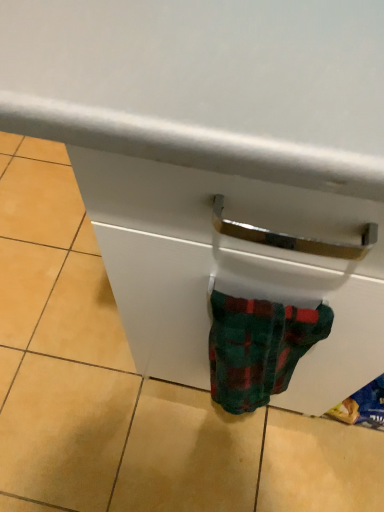
Question: From a real-world perspective, is white glossy drawer at center located higher than fluffy plaid sock at lower right?

Choices:
 (A) no
 (B) yes

Answer: (A)

Question: Is white glossy drawer at center facing towards fluffy plaid sock at lower right?

Choices:
 (A) yes
 (B) no

Answer: (B)

Question: Considering the relative sizes of white glossy drawer at center and fluffy plaid sock at lower right in the image provided, is white glossy drawer at center bigger than fluffy plaid sock at lower right?

Choices:
 (A) no
 (B) yes

Answer: (B)

Question: Does white glossy drawer at center have a greater height compared to fluffy plaid sock at lower right?

Choices:
 (A) yes
 (B) no

Answer: (B)

Question: From the image's perspective, is white glossy drawer at center beneath fluffy plaid sock at lower right?

Choices:
 (A) no
 (B) yes

Answer: (A)

Question: Does white glossy drawer at center have a smaller size compared to fluffy plaid sock at lower right?

Choices:
 (A) yes
 (B) no

Answer: (B)

Question: Is fluffy plaid sock at lower right smaller than white glossy drawer at center?

Choices:
 (A) yes
 (B) no

Answer: (A)

Question: Can you see fluffy plaid sock at lower right touching white glossy drawer at center?

Choices:
 (A) no
 (B) yes

Answer: (B)

Question: Is fluffy plaid sock at lower right to the left of white glossy drawer at center from the viewer's perspective?

Choices:
 (A) no
 (B) yes

Answer: (A)

Question: Can you confirm if fluffy plaid sock at lower right is taller than white glossy drawer at center?

Choices:
 (A) yes
 (B) no

Answer: (A)

Question: Is fluffy plaid sock at lower right shorter than white glossy drawer at center?

Choices:
 (A) yes
 (B) no

Answer: (B)

Question: Can you confirm if fluffy plaid sock at lower right is positioned to the right of white glossy drawer at center?

Choices:
 (A) yes
 (B) no

Answer: (A)

Question: Is white glossy drawer at center inside the boundaries of fluffy plaid sock at lower right, or outside?

Choices:
 (A) outside
 (B) inside

Answer: (A)